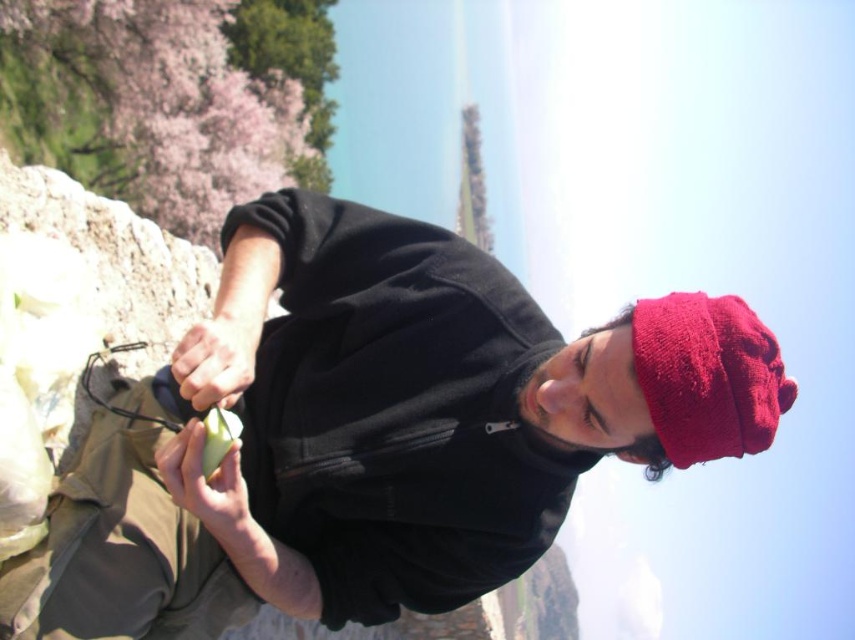
You are a photographer taking a picture of the scene described. You want to ensure that the red fuzzy hat at upper right is positioned exactly at the center of the image. Given its current coordinates at point 0.588, 0.829, what adjustment should you make to the camera frame to center it?

To center the red fuzzy hat at upper right, adjust the camera frame so that its coordinates move from (708,376) to (427,320).

You are standing at the camera position and want to place a new red fuzzy hat at upper right. The minimum distance required for the hat to be visible is 15 feet. Is the current distance sufficient?

The red fuzzy hat at upper right and camera are 17.15 feet apart, which is more than the 15 feet minimum distance required. Therefore, the hat will be visible.